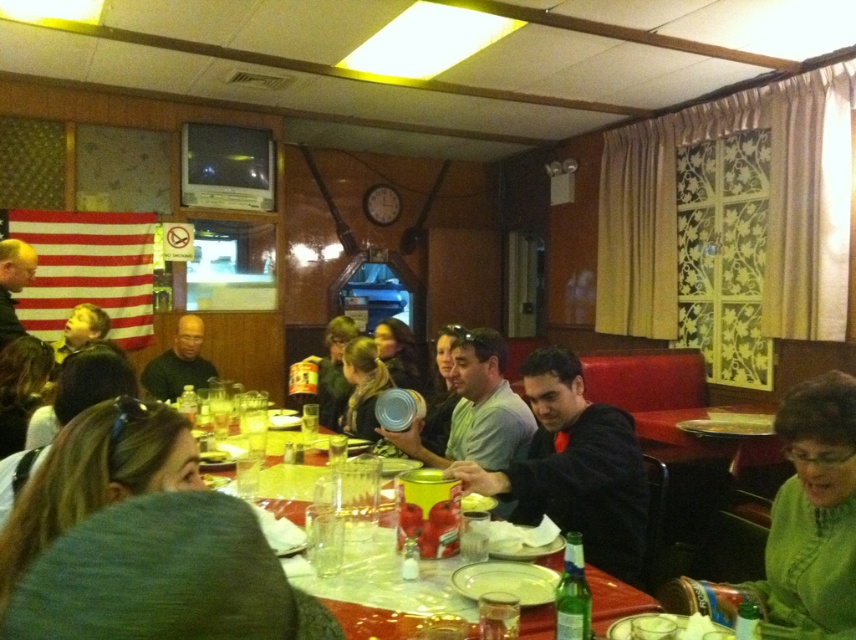
Question: Estimate the real-world distances between objects in this image. Which object is closer to the matte black can at center?

Choices:
 (A) black matte jacket at center
 (B) matte black hair at center
 (C) matte silver can at center
 (D) green matte sweater at lower right

Answer: (B)

Question: Does matte silver can at center appear on the left side of matte black can at center?

Choices:
 (A) yes
 (B) no

Answer: (B)

Question: Does green matte sweater at lower right come in front of matte black hair at center?

Choices:
 (A) yes
 (B) no

Answer: (A)

Question: Which of these objects is positioned closest to the matte yellow container at center?

Choices:
 (A) smooth leather jacket at upper left
 (B) dark green sweater at center
 (C) matte black can at center
 (D) matte silver can at center

Answer: (D)

Question: Which of the following is the closest to the observer?

Choices:
 (A) (412, 348)
 (B) (492, 435)

Answer: (B)

Question: Is green matte sweater at lower right bigger than yellow shirt at upper left?

Choices:
 (A) yes
 (B) no

Answer: (A)